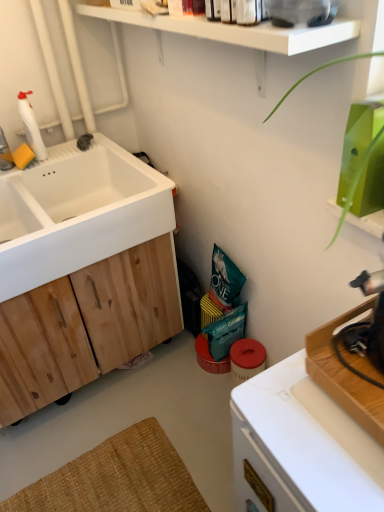
Describe the element at coordinates (86, 325) in the screenshot. The width and height of the screenshot is (384, 512). I see `natural wood cabinet at left` at that location.

What is the approximate height of white glossy faucet at left?

white glossy faucet at left is 7.37 inches in height.

What do you see at coordinates (5, 153) in the screenshot?
I see `white glossy faucet at left` at bounding box center [5, 153].

Identify the location of white plastic bottle at upper left. (31, 126).

Is white matte sink at left bigger than white glossy faucet at left?

Yes.

In the scene shown: Which of these two, white matte sink at left or white glossy faucet at left, is wider?

With larger width is white matte sink at left.

From a real-world perspective, is white matte sink at left physically located above or below white glossy faucet at left?

white matte sink at left is situated lower than white glossy faucet at left in the real world.

From the image's perspective, which is above, white matte sink at left or white glossy faucet at left?

white glossy faucet at left appears higher in the image.

Which is less distant, (44,216) or (313,504)?

The point (313,504) is in front.

Which is more to the left, white matte sink at left or white plastic countertop at lower right?

white matte sink at left.

Can you confirm if white matte sink at left is smaller than white plastic countertop at lower right?

Correct, white matte sink at left occupies less space than white plastic countertop at lower right.

Is white glossy faucet at left at the left side of white matte sink at left?

Indeed, white glossy faucet at left is positioned on the left side of white matte sink at left.

Measure the distance between white glossy faucet at left and white matte sink at left.

15.05 inches.

Considering the positions of point (1, 152) and point (100, 236), is point (1, 152) closer or farther from the camera than point (100, 236)?

Clearly, point (1, 152) is more distant from the camera than point (100, 236).

Considering the positions of objects white matte sink at left and natural wood cabinet at left in the image provided, who is in front, white matte sink at left or natural wood cabinet at left?

white matte sink at left is closer to the camera.

From the image's perspective, does white matte sink at left appear higher than natural wood cabinet at left?

Yes, from the image's perspective, white matte sink at left is above natural wood cabinet at left.

Do you think white matte sink at left is within natural wood cabinet at left, or outside of it?

white matte sink at left is not inside natural wood cabinet at left, it's outside.

Based on the photo, can you confirm if white matte sink at left is smaller than natural wood cabinet at left?

Indeed, white matte sink at left has a smaller size compared to natural wood cabinet at left.

Which object is further away from the camera taking this photo, white glossy faucet at left or natural wood cabinet at left?

white glossy faucet at left.

Is there a large distance between white glossy faucet at left and natural wood cabinet at left?

Actually, white glossy faucet at left and natural wood cabinet at left are a little close together.

Considering the sizes of objects white glossy faucet at left and natural wood cabinet at left in the image provided, who is bigger, white glossy faucet at left or natural wood cabinet at left?

natural wood cabinet at left.

Choose the correct answer: Is white glossy faucet at left inside white plastic bottle at upper left or outside it?

white glossy faucet at left is not inside white plastic bottle at upper left, it's outside.

From the image's perspective, who appears lower, white glossy faucet at left or white plastic bottle at upper left?

white glossy faucet at left, from the image's perspective.

Is white glossy faucet at left facing away from white plastic bottle at upper left?

No, white glossy faucet at left's orientation is not away from white plastic bottle at upper left.

Based on the photo, measure the distance from white glossy faucet at left to white plastic bottle at upper left.

The distance of white glossy faucet at left from white plastic bottle at upper left is 12.92 centimeters.

How much distance is there between white plastic countertop at lower right and white glossy faucet at left?

They are 1.39 meters apart.

In terms of height, does white plastic countertop at lower right look taller or shorter compared to white glossy faucet at left?

white plastic countertop at lower right is taller than white glossy faucet at left.

From a real-world perspective, between white plastic countertop at lower right and white glossy faucet at left, who is vertically lower?

From a 3D spatial view, white plastic countertop at lower right is below.

Considering the relative sizes of white plastic countertop at lower right and white glossy faucet at left in the image provided, is white plastic countertop at lower right thinner than white glossy faucet at left?

No, white plastic countertop at lower right is not thinner than white glossy faucet at left.

Identify the location of sink in front of the white glossy faucet at left. The image size is (384, 512). (77, 212).

Locate an element on the screen. This screenshot has height=512, width=384. sink that is on the left side of white plastic countertop at lower right is located at coordinates (77, 212).

When comparing their distances from white matte sink at left, does natural wood cabinet at left or white plastic countertop at lower right seem further?

white plastic countertop at lower right is further to white matte sink at left.

Estimate the real-world distances between objects in this image. Which object is further from natural wood cabinet at left, white plastic bottle at upper left or white glossy faucet at left?

white glossy faucet at left lies further to natural wood cabinet at left than the other object.

Estimate the real-world distances between objects in this image. Which object is closer to white plastic countertop at lower right, white glossy faucet at left or white plastic bottle at upper left?

white plastic bottle at upper left lies closer to white plastic countertop at lower right than the other object.

When comparing their distances from white glossy faucet at left, does white plastic bottle at upper left or white matte sink at left seem further?

Among the two, white matte sink at left is located further to white glossy faucet at left.

Which object lies further to the anchor point white plastic bottle at upper left, white matte sink at left or white plastic countertop at lower right?

white plastic countertop at lower right is positioned further to the anchor white plastic bottle at upper left.

Based on the photo, considering their positions, is white plastic countertop at lower right positioned closer to natural wood cabinet at left than white plastic bottle at upper left?

white plastic bottle at upper left.

Looking at the image, which one is located further to white plastic bottle at upper left, white glossy faucet at left or white matte sink at left?

white matte sink at left lies further to white plastic bottle at upper left than the other object.

Looking at the image, which one is located further to white glossy faucet at left, natural wood cabinet at left or white plastic countertop at lower right?

white plastic countertop at lower right is positioned further to the anchor white glossy faucet at left.

Identify the location of faucet positioned between white matte sink at left and white plastic bottle at upper left from near to far. The width and height of the screenshot is (384, 512). (5, 153).

The height and width of the screenshot is (512, 384). In order to click on cleaning product situated between white glossy faucet at left and white plastic countertop at lower right from left to right in this screenshot , I will do `click(31, 126)`.

Locate an element on the screen. sink between natural wood cabinet at left and white plastic countertop at lower right from left to right is located at coordinates (77, 212).

Where is `sink situated between white glossy faucet at left and white plastic countertop at lower right from left to right`? Image resolution: width=384 pixels, height=512 pixels. sink situated between white glossy faucet at left and white plastic countertop at lower right from left to right is located at coordinates (77, 212).